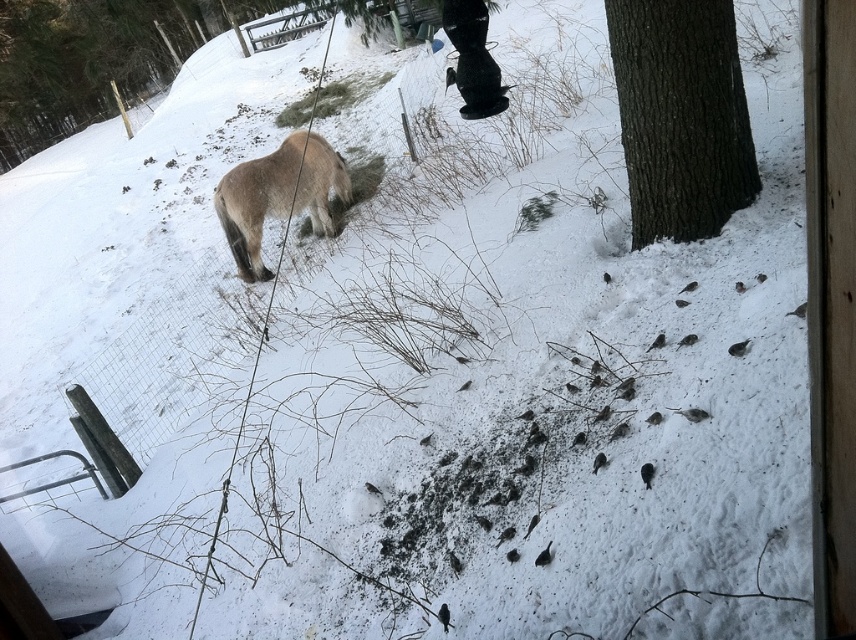
Question: Is dark brown bark at right to the right of fuzzy brown pony at upper left from the viewer's perspective?

Choices:
 (A) no
 (B) yes

Answer: (B)

Question: Which point is closer to the camera?

Choices:
 (A) (675, 138)
 (B) (241, 273)

Answer: (A)

Question: Among these objects, which one is farthest from the camera?

Choices:
 (A) fuzzy brown pony at upper left
 (B) dark brown bark at right

Answer: (A)

Question: Does dark brown bark at right have a lesser width compared to fuzzy brown pony at upper left?

Choices:
 (A) no
 (B) yes

Answer: (B)

Question: Which object appears closest to the camera in this image?

Choices:
 (A) fuzzy brown pony at upper left
 (B) dark brown bark at right

Answer: (B)

Question: Is dark brown bark at right thinner than fuzzy brown pony at upper left?

Choices:
 (A) no
 (B) yes

Answer: (B)